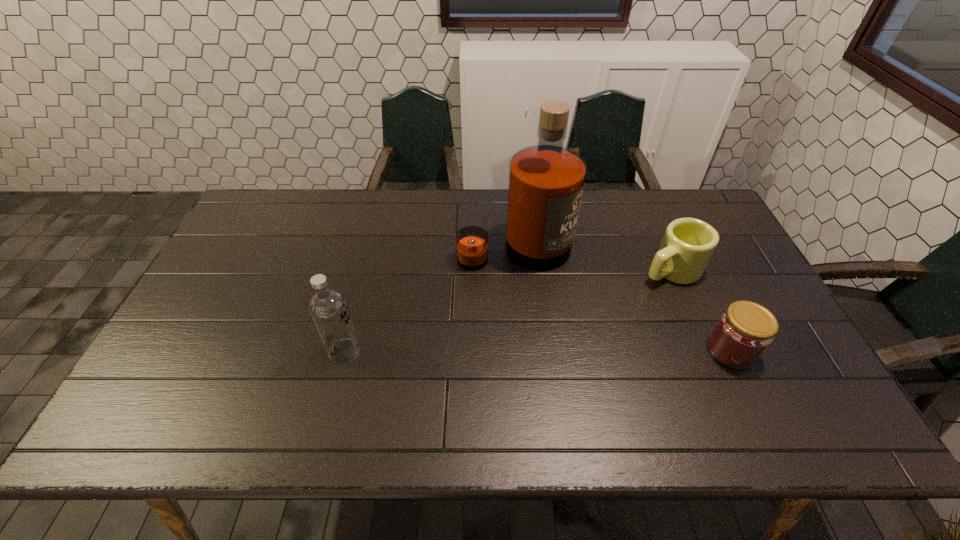
Where is `vacant space at the near edge of the desktop`? vacant space at the near edge of the desktop is located at coordinates (672, 365).

Locate an element on the screen. The height and width of the screenshot is (540, 960). blank space at the left edge is located at coordinates (235, 338).

Find the location of a particular element. The width and height of the screenshot is (960, 540). free space at the right edge is located at coordinates (751, 279).

Image resolution: width=960 pixels, height=540 pixels. Find the location of `vacant area that lies between the jam and the mug`. vacant area that lies between the jam and the mug is located at coordinates (701, 310).

Image resolution: width=960 pixels, height=540 pixels. What are the coordinates of `free space between the jam and the vodka` in the screenshot? It's located at (538, 351).

You are a GUI agent. You are given a task and a screenshot of the screen. Output one action in this format:
    pyautogui.click(x=<x>, y=<y>)
    Task: Click on the empty space between the vodka and the jam
    
    Given the screenshot: What is the action you would take?
    pyautogui.click(x=538, y=351)

The width and height of the screenshot is (960, 540). I want to click on free area in between the mug and the third shortest object, so click(508, 310).

Identify the location of blank region between the mug and the second tallest object. The height and width of the screenshot is (540, 960). (508, 310).

Locate an element on the screen. This screenshot has width=960, height=540. free space between the third object from right to left and the jam is located at coordinates (623, 299).

This screenshot has width=960, height=540. I want to click on vacant area that lies between the third shortest object and the jam, so click(538, 351).